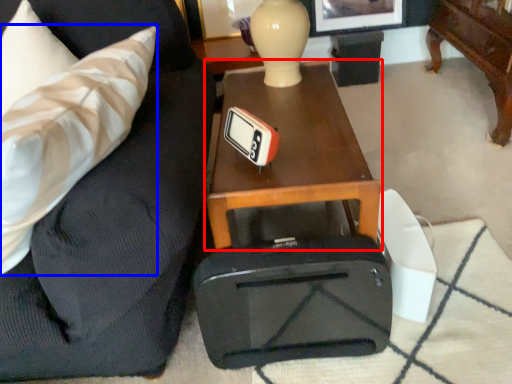
Question: Which object is closer to the camera taking this photo, table (highlighted by a red box) or throw pillow (highlighted by a blue box)?

Choices:
 (A) table
 (B) throw pillow

Answer: (B)